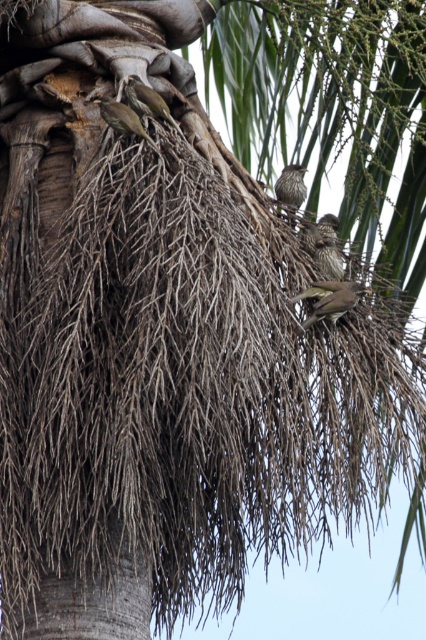
Consider the image. Does brown speckled feathers at upper right come in front of brown speckled feathers at upper left?

That is False.

Does brown speckled feathers at upper right appear on the left side of brown speckled feathers at upper left?

In fact, brown speckled feathers at upper right is to the right of brown speckled feathers at upper left.

Which is behind, point (333, 246) or point (101, 99)?

Positioned behind is point (333, 246).

Image resolution: width=426 pixels, height=640 pixels. I want to click on brown speckled feathers at upper right, so click(x=324, y=244).

Between speckled brown bird at upper left and brown speckled feathers at center, which one is positioned lower?

brown speckled feathers at center

This screenshot has height=640, width=426. Describe the element at coordinates (147, 100) in the screenshot. I see `speckled brown bird at upper left` at that location.

Identify the location of speckled brown bird at upper left. This screenshot has height=640, width=426. (147, 100).

Can you confirm if green textured bird at center is smaller than speckled brown bird at upper left?

Yes, green textured bird at center is smaller than speckled brown bird at upper left.

Does green textured bird at center appear over speckled brown bird at upper left?

No, green textured bird at center is not above speckled brown bird at upper left.

This screenshot has width=426, height=640. Describe the element at coordinates (330, 300) in the screenshot. I see `green textured bird at center` at that location.

Where is `green textured bird at center`? This screenshot has width=426, height=640. green textured bird at center is located at coordinates (330, 300).